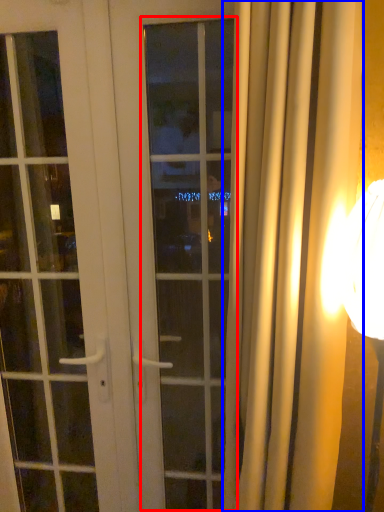
Question: Which point is further to the camera, window (highlighted by a red box) or curtain (highlighted by a blue box)?

Choices:
 (A) window
 (B) curtain

Answer: (A)